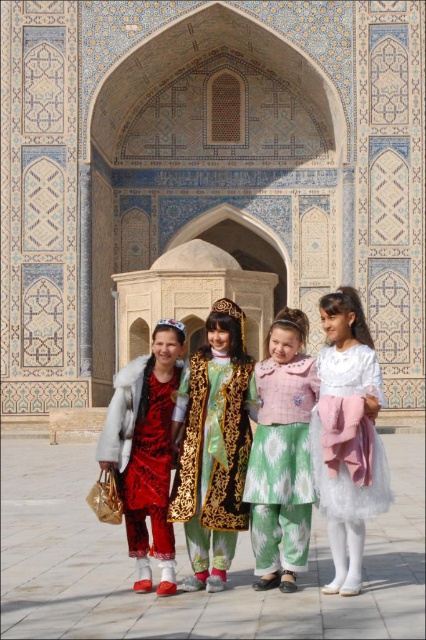
Is the position of pastel pink fabric dress at center less distant than that of red satin dress at left?

That is True.

Is pastel pink fabric dress at center smaller than red satin dress at left?

Yes, pastel pink fabric dress at center is smaller than red satin dress at left.

At what (x,y) coordinates should I click in order to perform the action: click on pastel pink fabric dress at center. Please return your answer as a coordinate pair (x, y). The height and width of the screenshot is (640, 426). Looking at the image, I should click on (282, 454).

At what (x,y) coordinates should I click in order to perform the action: click on pastel pink fabric dress at center. Please return your answer as a coordinate pair (x, y). Looking at the image, I should click on (282, 454).

Who is lower down, gold embroidered dress at center or pastel pink fabric dress at center?

Positioned lower is pastel pink fabric dress at center.

Is point (204, 456) behind point (299, 556)?

That is True.

Is point (230, 452) positioned after point (273, 570)?

Yes.

The width and height of the screenshot is (426, 640). What are the coordinates of `gold embroidered dress at center` in the screenshot? It's located at (213, 445).

Which is above, gold embroidered dress at center or red satin dress at left?

gold embroidered dress at center

Can you confirm if gold embroidered dress at center is taller than red satin dress at left?

Yes.

Who is more distant from viewer, (244,424) or (149,499)?

The point (244,424) is behind.

You are a GUI agent. You are given a task and a screenshot of the screen. Output one action in this format:
    pyautogui.click(x=<x>, y=<y>)
    Task: Click on the gold embroidered dress at center
    This screenshot has height=640, width=426.
    Given the screenshot: What is the action you would take?
    (x=213, y=445)